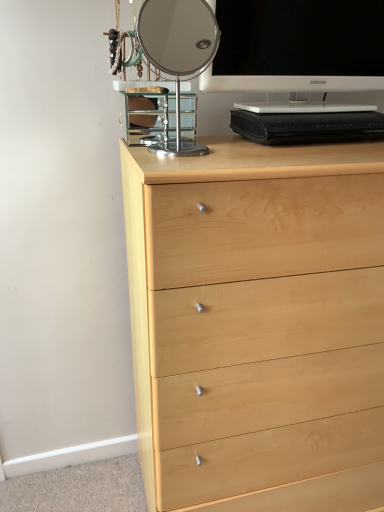
Question: Is light wood chest of drawers at center completely or partially outside of polished chrome mirror at upper center?

Choices:
 (A) no
 (B) yes

Answer: (B)

Question: Does light wood chest of drawers at center lie in front of polished chrome mirror at upper center?

Choices:
 (A) no
 (B) yes

Answer: (B)

Question: Is light wood chest of drawers at center turned away from polished chrome mirror at upper center?

Choices:
 (A) yes
 (B) no

Answer: (B)

Question: From the image's perspective, is light wood chest of drawers at center under polished chrome mirror at upper center?

Choices:
 (A) no
 (B) yes

Answer: (B)

Question: Would you say light wood chest of drawers at center contains polished chrome mirror at upper center?

Choices:
 (A) yes
 (B) no

Answer: (B)

Question: Considering the relative positions of light wood chest of drawers at center and polished chrome mirror at upper center in the image provided, is light wood chest of drawers at center to the left of polished chrome mirror at upper center from the viewer's perspective?

Choices:
 (A) no
 (B) yes

Answer: (A)

Question: Is polished chrome mirror at upper center not near natural wood drawer at lower center?

Choices:
 (A) no
 (B) yes

Answer: (B)

Question: Is polished chrome mirror at upper center taller than natural wood drawer at lower center?

Choices:
 (A) yes
 (B) no

Answer: (A)

Question: Is the depth of polished chrome mirror at upper center greater than that of natural wood drawer at lower center?

Choices:
 (A) no
 (B) yes

Answer: (A)

Question: Considering the relative sizes of polished chrome mirror at upper center and natural wood drawer at lower center in the image provided, is polished chrome mirror at upper center bigger than natural wood drawer at lower center?

Choices:
 (A) no
 (B) yes

Answer: (A)

Question: From the image's perspective, is polished chrome mirror at upper center beneath natural wood drawer at lower center?

Choices:
 (A) no
 (B) yes

Answer: (A)

Question: Is polished chrome mirror at upper center directly adjacent to natural wood drawer at lower center?

Choices:
 (A) yes
 (B) no

Answer: (B)

Question: From a real-world perspective, is light wood chest of drawers at center over white glossy television at upper right?

Choices:
 (A) no
 (B) yes

Answer: (A)